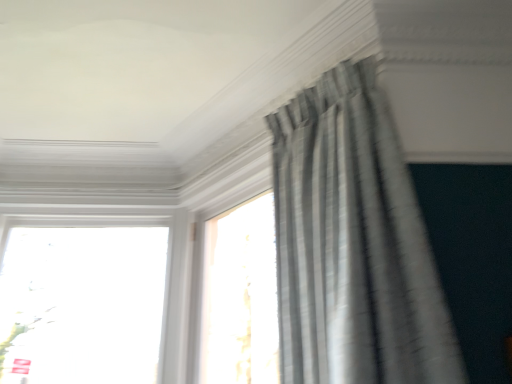
Question: Should I look upward or downward to see satin gray curtain at upper right?

Choices:
 (A) up
 (B) down

Answer: (B)